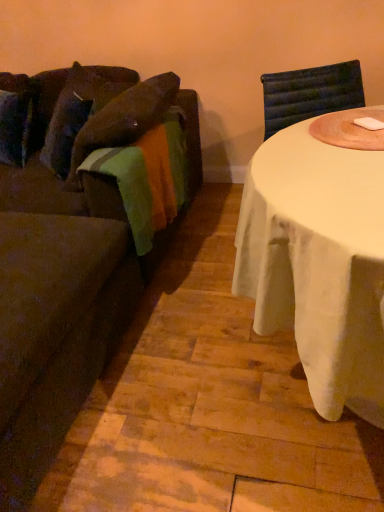
Question: From the image's perspective, relative to velvet brown couch at left, is velvety brown pillow at left above or below?

Choices:
 (A) below
 (B) above

Answer: (B)

Question: Is point (104, 86) closer or farther from the camera than point (18, 280)?

Choices:
 (A) closer
 (B) farther

Answer: (B)

Question: From a real-world perspective, is velvety brown pillow at left above or below velvet brown couch at left?

Choices:
 (A) below
 (B) above

Answer: (B)

Question: In terms of size, does velvet brown couch at left appear bigger or smaller than velvety brown pillow at left?

Choices:
 (A) big
 (B) small

Answer: (A)

Question: In terms of width, does velvet brown couch at left look wider or thinner when compared to velvety brown pillow at left?

Choices:
 (A) thin
 (B) wide

Answer: (B)

Question: Is point (109, 269) closer or farther from the camera than point (92, 111)?

Choices:
 (A) closer
 (B) farther

Answer: (A)

Question: From a real-world perspective, is velvet brown couch at left positioned above or below velvety brown pillow at left?

Choices:
 (A) below
 (B) above

Answer: (A)